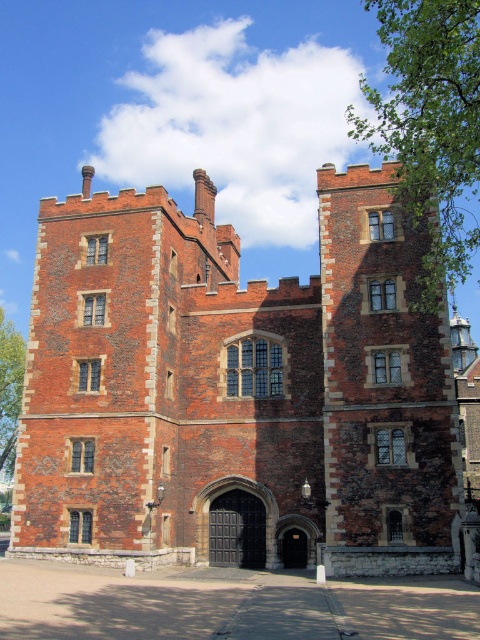
You are standing at the coordinates point (235, 387) in the image of a historic brick building. What significant structure is located at this point?

The point (235, 387) marks the brick stone castle at center.

You are a visitor arriving at the historic brick building and need to enter through either the dark brown wooden gate at center or the smooth stone archway at center. Which entrance is wider and can accommodate a large cart?

The smooth stone archway at center is wider than the dark brown wooden gate at center, so the large cart can pass through the smooth stone archway at center.